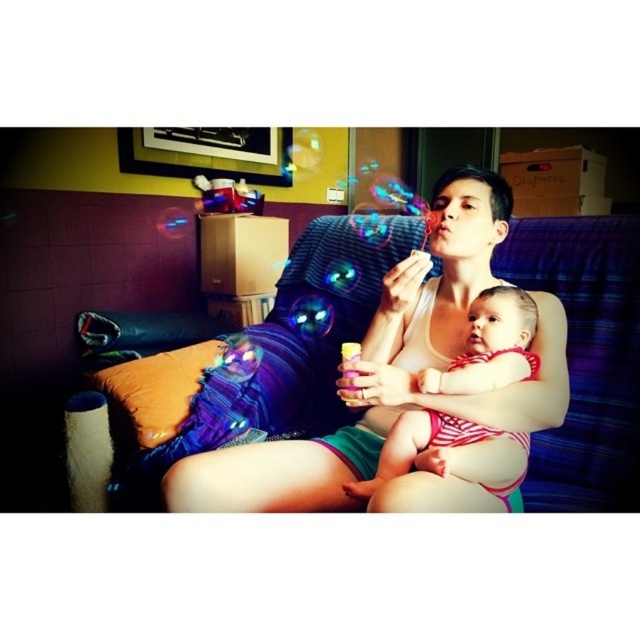
Question: Is matte white tank top at center further to the viewer compared to striped fabric baby at center?

Choices:
 (A) yes
 (B) no

Answer: (B)

Question: Does matte white tank top at center come in front of striped fabric baby at center?

Choices:
 (A) yes
 (B) no

Answer: (A)

Question: Among these objects, which one is nearest to the camera?

Choices:
 (A) striped fabric baby at center
 (B) matte white tank top at center

Answer: (B)

Question: Is the position of matte white tank top at center more distant than that of striped fabric baby at center?

Choices:
 (A) no
 (B) yes

Answer: (A)

Question: Which point is closer to the camera taking this photo?

Choices:
 (A) (529, 371)
 (B) (490, 218)

Answer: (A)